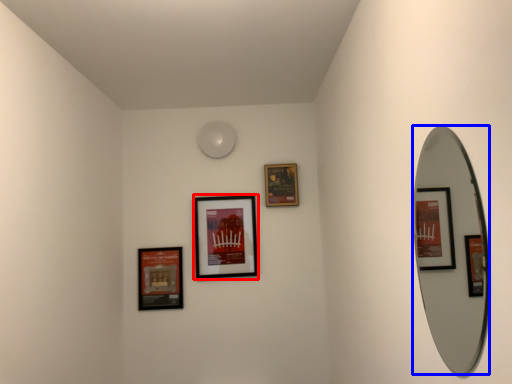
Question: Which object appears closest to the camera in this image, picture frame (highlighted by a red box) or mirror (highlighted by a blue box)?

Choices:
 (A) picture frame
 (B) mirror

Answer: (B)